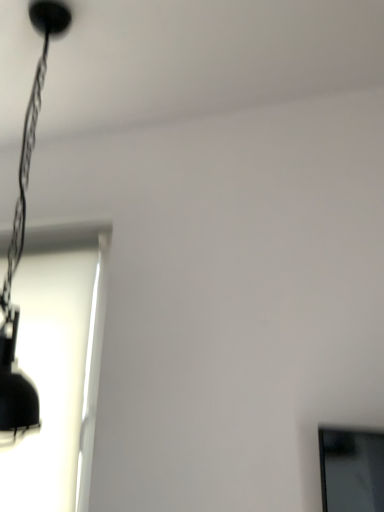
Question: Considering the positions of point (43, 48) and point (52, 391), is point (43, 48) closer or farther from the camera than point (52, 391)?

Choices:
 (A) farther
 (B) closer

Answer: (B)

Question: Based on their positions, is matte black lamp at upper left located to the left or right of white matte window at left?

Choices:
 (A) left
 (B) right

Answer: (B)

Question: Which is correct: matte black lamp at upper left is inside white matte window at left, or outside of it?

Choices:
 (A) outside
 (B) inside

Answer: (A)

Question: Based on their positions, is white matte window at left located to the left or right of matte black lamp at upper left?

Choices:
 (A) left
 (B) right

Answer: (A)

Question: Does point (54, 440) appear closer or farther from the camera than point (18, 376)?

Choices:
 (A) farther
 (B) closer

Answer: (A)

Question: From a real-world perspective, relative to matte black lamp at upper left, is white matte window at left vertically above or below?

Choices:
 (A) above
 (B) below

Answer: (B)

Question: In terms of height, does white matte window at left look taller or shorter compared to matte black lamp at upper left?

Choices:
 (A) short
 (B) tall

Answer: (A)